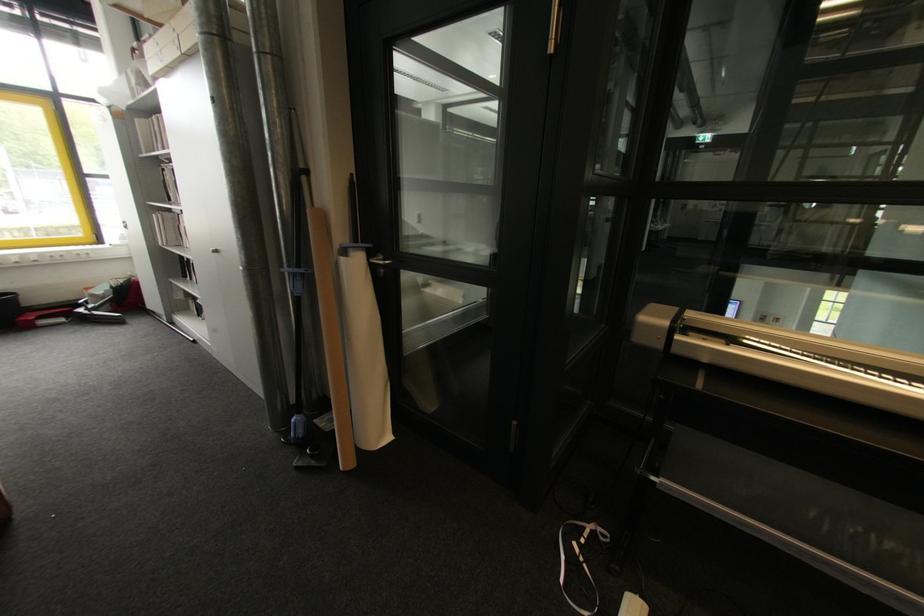
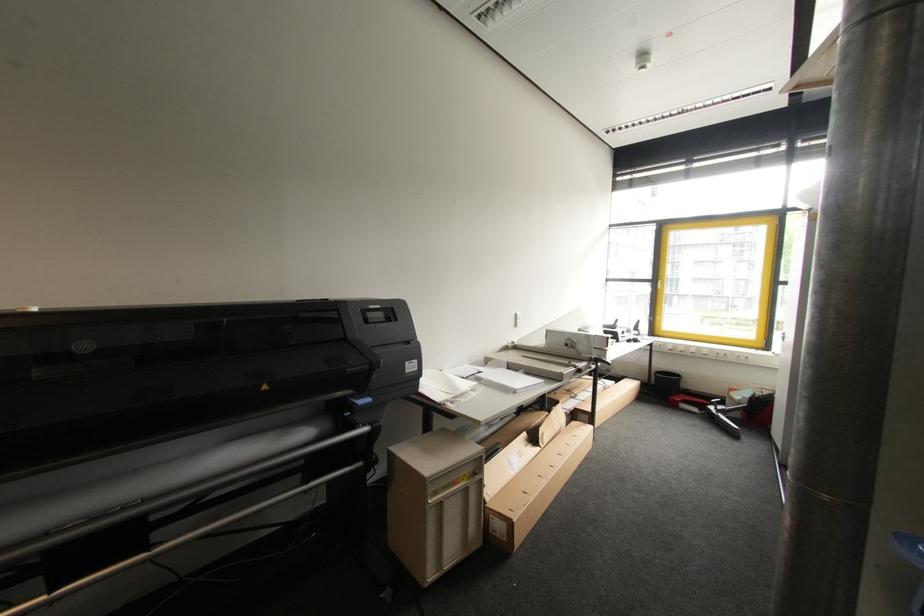
Locate, in the second image, the point that corresponds to point 66,321 in the first image.

(699, 411)